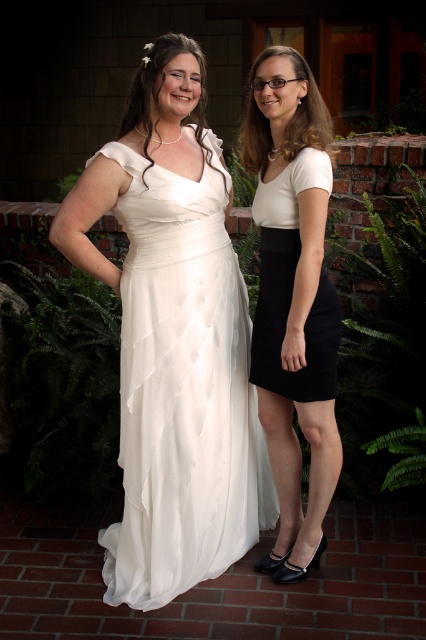
Is white satin dress at center thinner than black matte skirt at right?

No, white satin dress at center is not thinner than black matte skirt at right.

Does white satin dress at center lie in front of black matte skirt at right?

No.

What are the coordinates of `white satin dress at center` in the screenshot? It's located at click(x=173, y=339).

This screenshot has width=426, height=640. I want to click on white satin dress at center, so click(x=173, y=339).

Does point (173, 257) lie behind point (279, 212)?

Yes, it is.

Can you confirm if white satin dress at center is positioned below matte white blouse at center?

No.

Identify the location of white satin dress at center. (173, 339).

Can you confirm if matte white blouse at center is positioned to the left of black matte skirt at right?

In fact, matte white blouse at center is to the right of black matte skirt at right.

Describe the element at coordinates (293, 300) in the screenshot. I see `matte white blouse at center` at that location.

Who is more distant from viewer, (313, 109) or (273, 312)?

The point (273, 312) is behind.

This screenshot has height=640, width=426. Identify the location of matte white blouse at center. (293, 300).